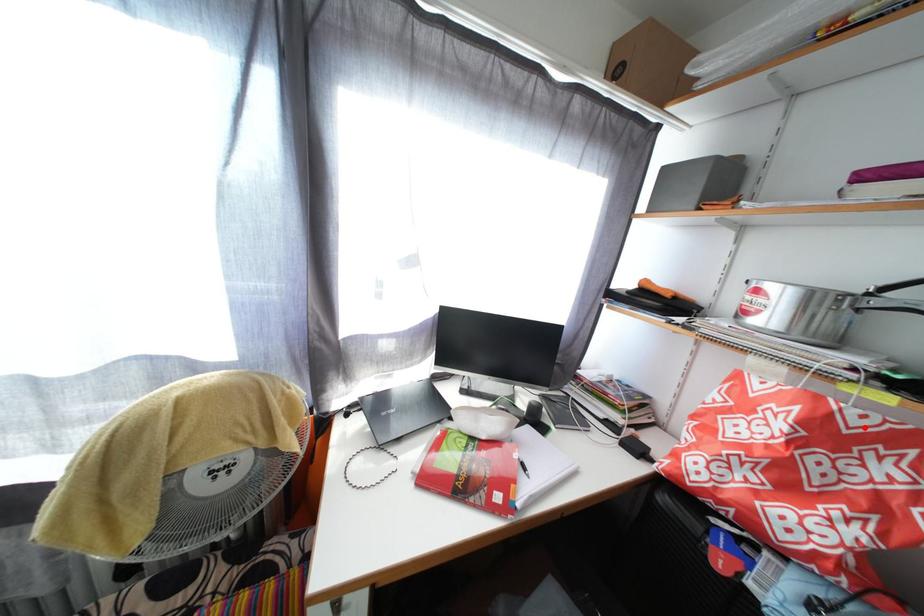
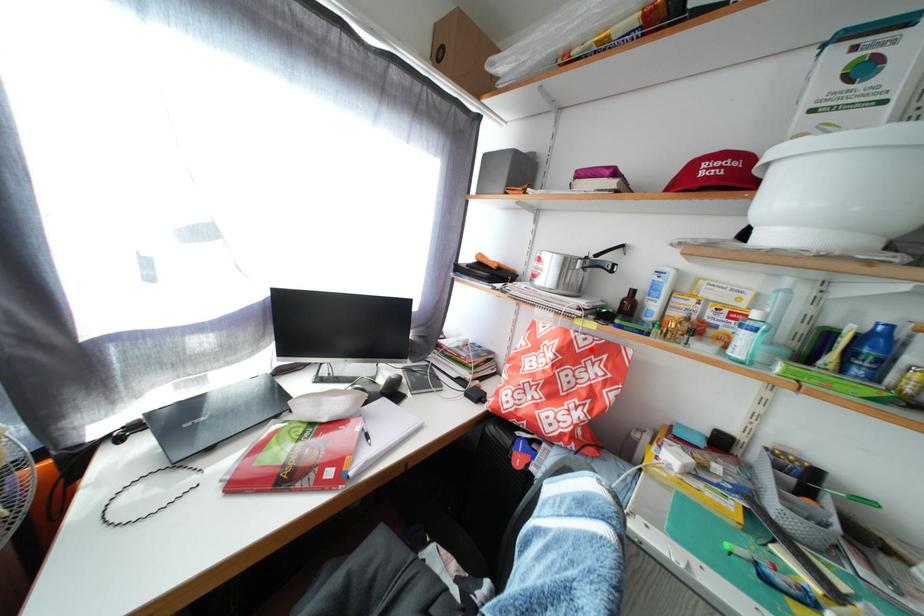
Consider the image. I am providing you with two images of the same scene from different viewpoints. A red point is marked on the first image and another point is marked on the second image. Are the points marked in image1 and image2 representing the same 3D position?

Yes